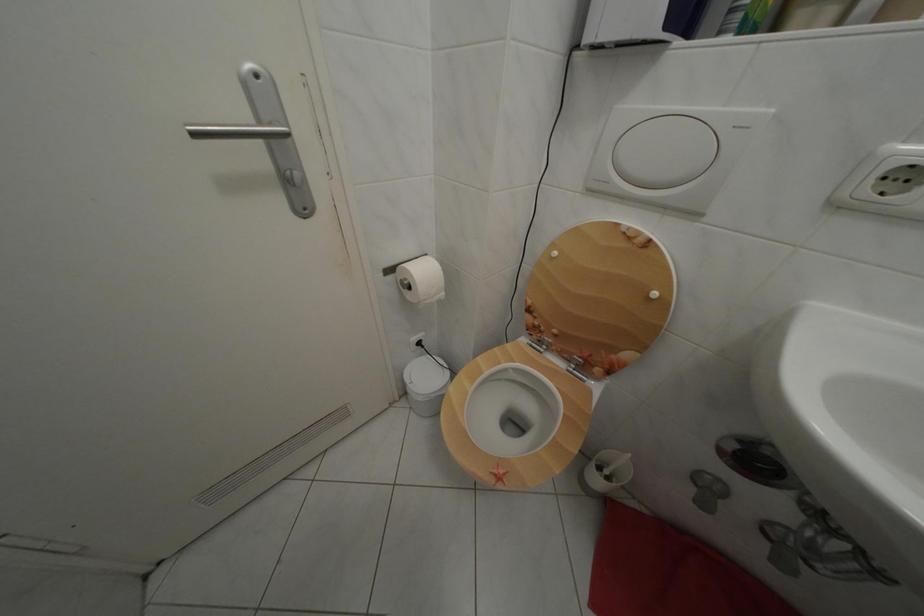
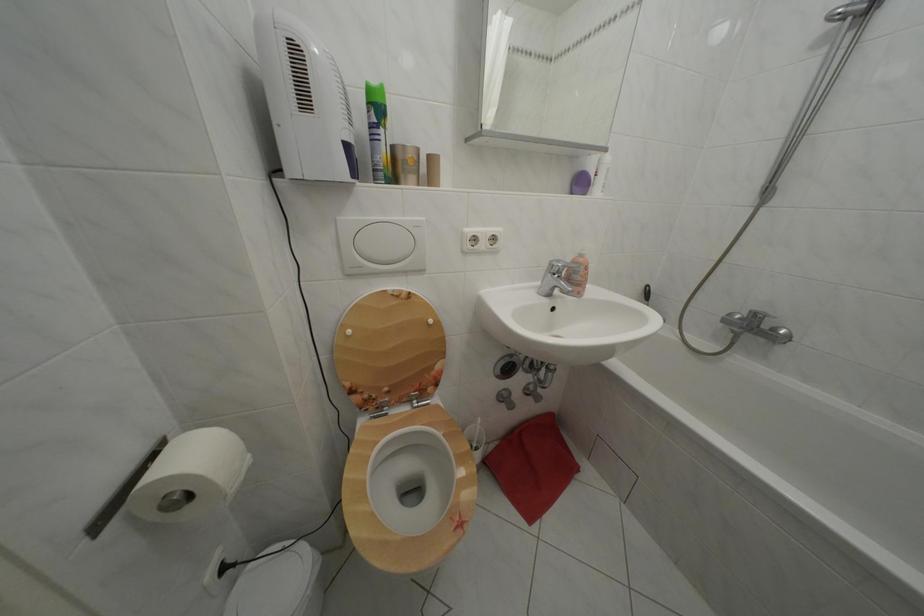
The point at (564, 259) is marked in the first image. Where is the corresponding point in the second image?

(358, 338)